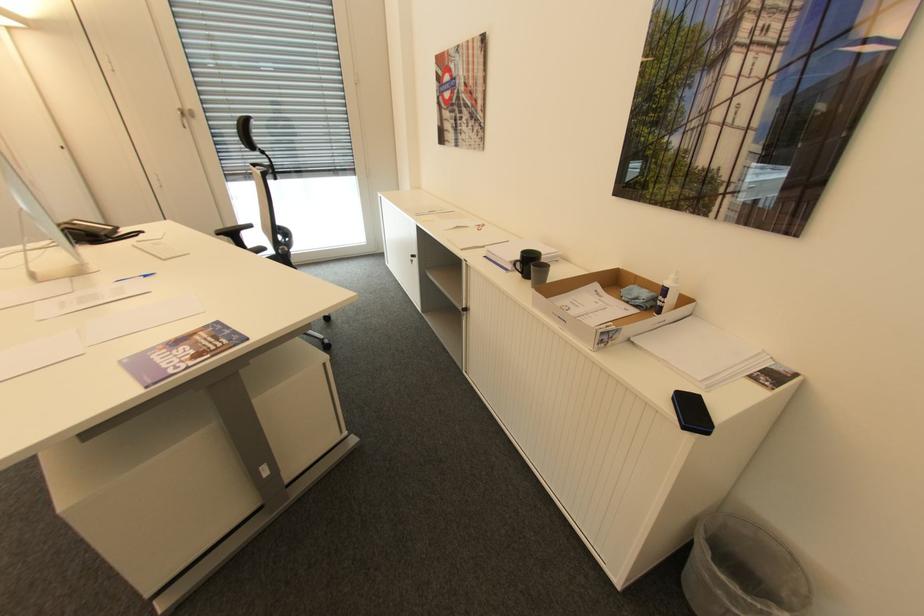
Where is `telephone handset`? This screenshot has height=616, width=924. telephone handset is located at coordinates (93, 232).